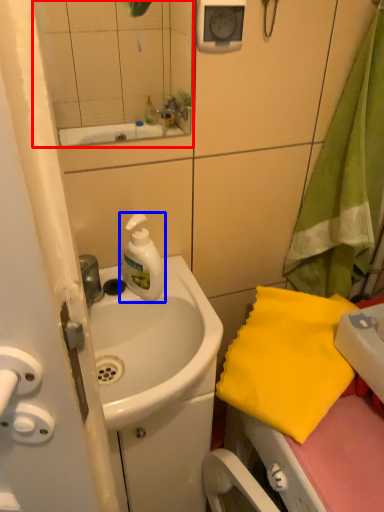
Question: Which point is closer to the camera, mirror (highlighted by a red box) or cleaning product (highlighted by a blue box)?

Choices:
 (A) mirror
 (B) cleaning product

Answer: (A)